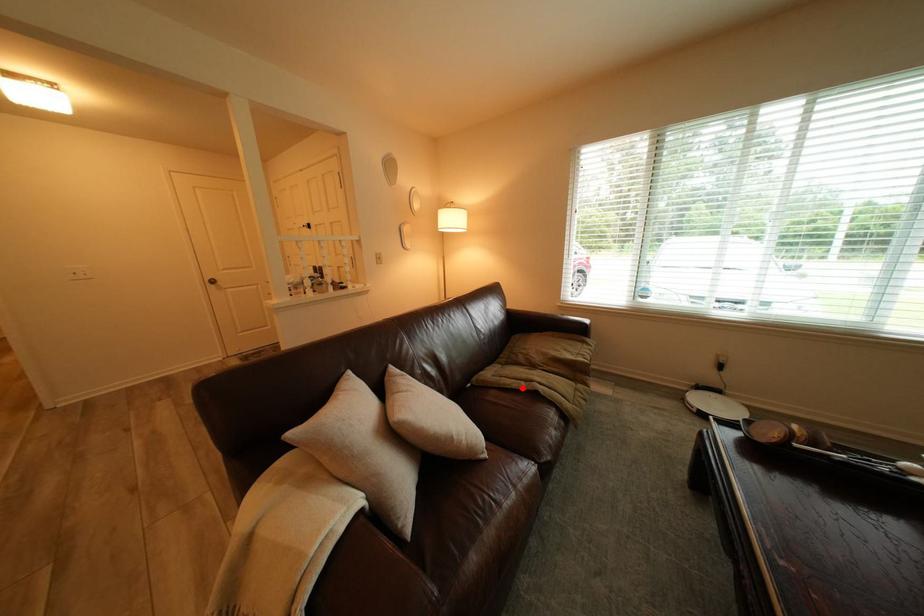
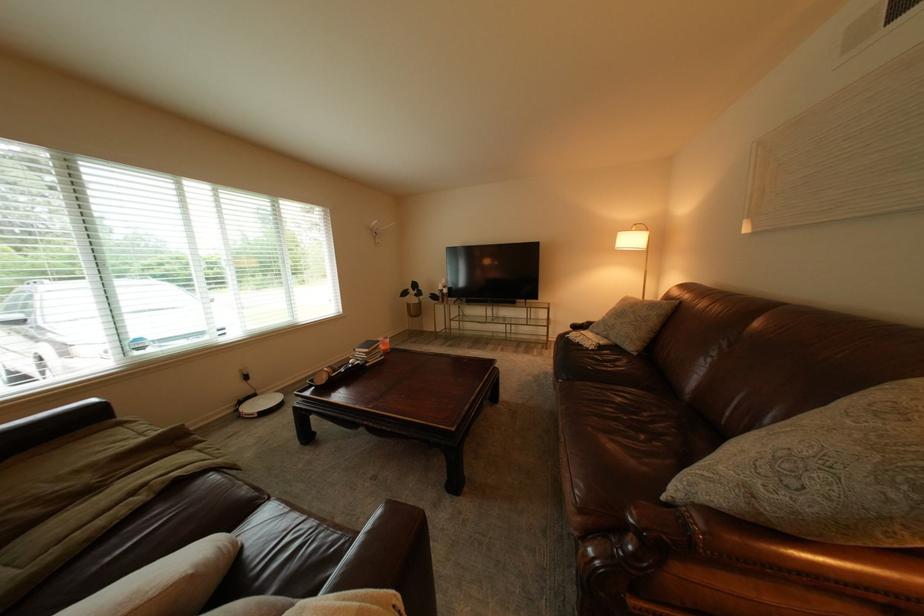
Where in the second image is the point corresponding to the highlighted location from the first image?

(130, 523)